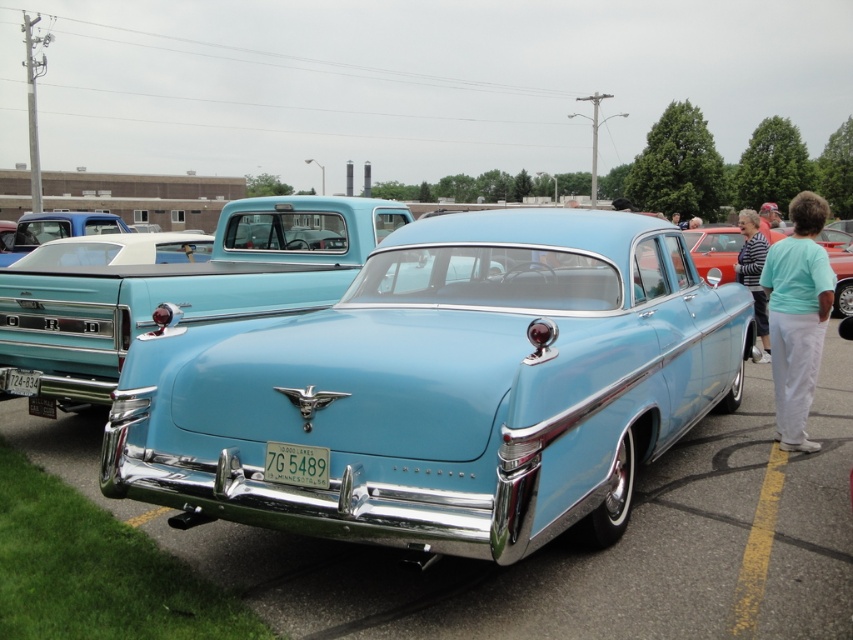
You are a photographer standing in front of the light blue 1950s Mercury sedan. You notice two license plates in your viewfinder. Which license plate, the green matte license plate at center or the white plastic license plate at lower center, is positioned closer to you?

The green matte license plate at center is closer to the viewer than the white plastic license plate at lower center, so the green matte license plate at center is positioned closer to you.

You are a photographer at the car event and want to capture both the green matte license plate at center and the white plastic license plate at lower center in a single frame. Which license plate will appear narrower in your photo?

The green matte license plate at center is thinner than the white plastic license plate at lower center, so it will appear narrower in the photo.